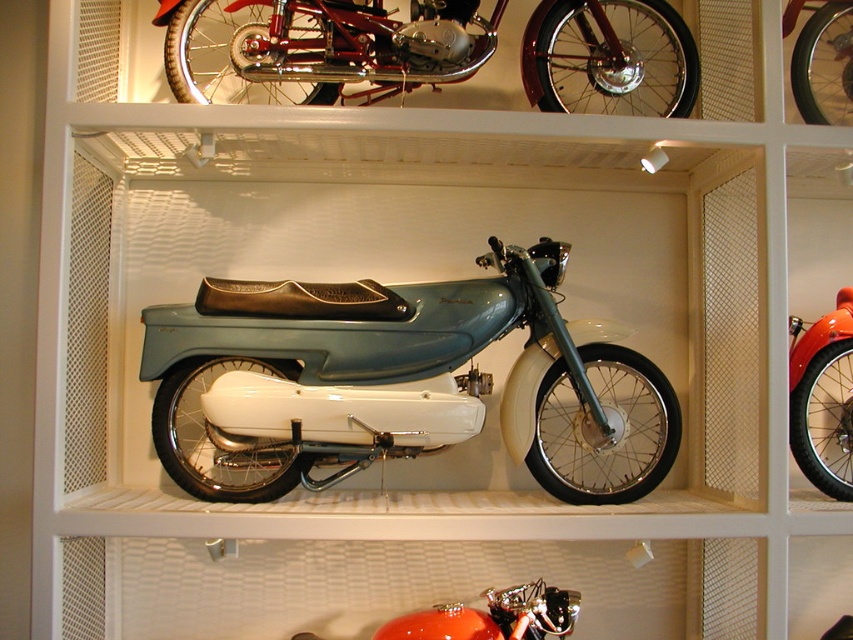
Question: Observing the image, what is the correct spatial positioning of shiny red motorcycle at center in reference to orange glossy motorcycle at lower center?

Choices:
 (A) right
 (B) left

Answer: (A)

Question: Observing the image, what is the correct spatial positioning of shiny red motorcycle at center in reference to orange glossy motorcycle at lower center?

Choices:
 (A) above
 (B) below

Answer: (A)

Question: Is the position of teal matte/metallic motorcycle at center more distant than that of orange glossy motorcycle at lower center?

Choices:
 (A) no
 (B) yes

Answer: (B)

Question: Which object appears farthest from the camera in this image?

Choices:
 (A) shiny red motorcycle at center
 (B) teal matte/metallic motorcycle at center
 (C) shiny chrome wheel at upper right
 (D) shiny chrome motorcycle at upper center

Answer: (C)

Question: Which object is farther from the camera taking this photo?

Choices:
 (A) shiny red motorcycle at center
 (B) orange glossy motorcycle at lower center
 (C) shiny chrome wheel at upper right
 (D) teal matte/metallic motorcycle at center

Answer: (C)

Question: Which is nearer to the orange glossy motorcycle at lower center?

Choices:
 (A) teal matte/metallic motorcycle at center
 (B) shiny chrome wheel at upper right
 (C) shiny red motorcycle at center

Answer: (A)